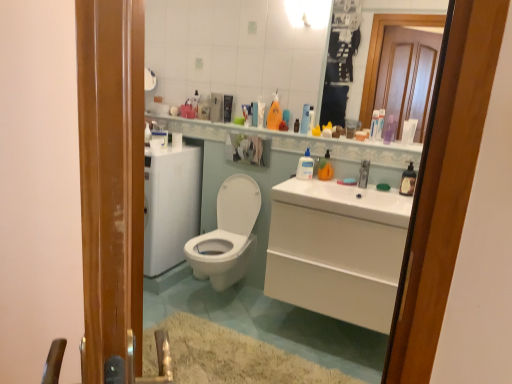
I want to click on free point below white glossy toilet at center (from a real-world perspective), so [x=216, y=301].